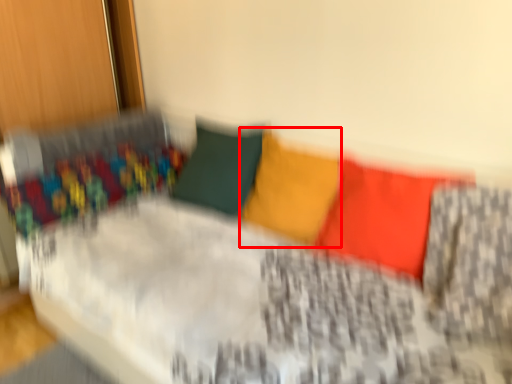
Question: From the image's perspective, where is pillow (annotated by the red box) located in relation to pillow in the image?

Choices:
 (A) above
 (B) below

Answer: (A)